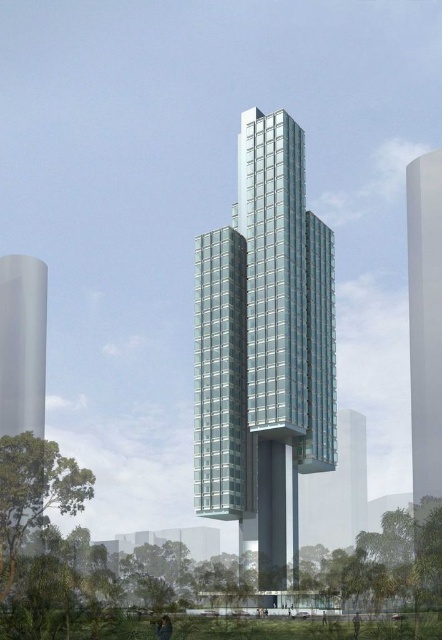
Question: Is clear glass tower at center to the left of transparent glass tower at left from the viewer's perspective?

Choices:
 (A) no
 (B) yes

Answer: (A)

Question: Among these points, which one is nearest to the camera?

Choices:
 (A) (431, 497)
 (B) (4, 314)
 (C) (228, 477)

Answer: (C)

Question: Which of these objects is positioned closest to the transparent glass tower at left?

Choices:
 (A) white glossy tower at right
 (B) clear glass tower at center

Answer: (B)

Question: Is clear glass tower at center further to camera compared to transparent glass tower at left?

Choices:
 (A) no
 (B) yes

Answer: (B)

Question: Which of the following is the farthest from the observer?

Choices:
 (A) (441, 400)
 (B) (293, 406)
 (C) (3, 348)

Answer: (C)

Question: Is clear glass tower at center positioned in front of transparent glass tower at left?

Choices:
 (A) no
 (B) yes

Answer: (A)